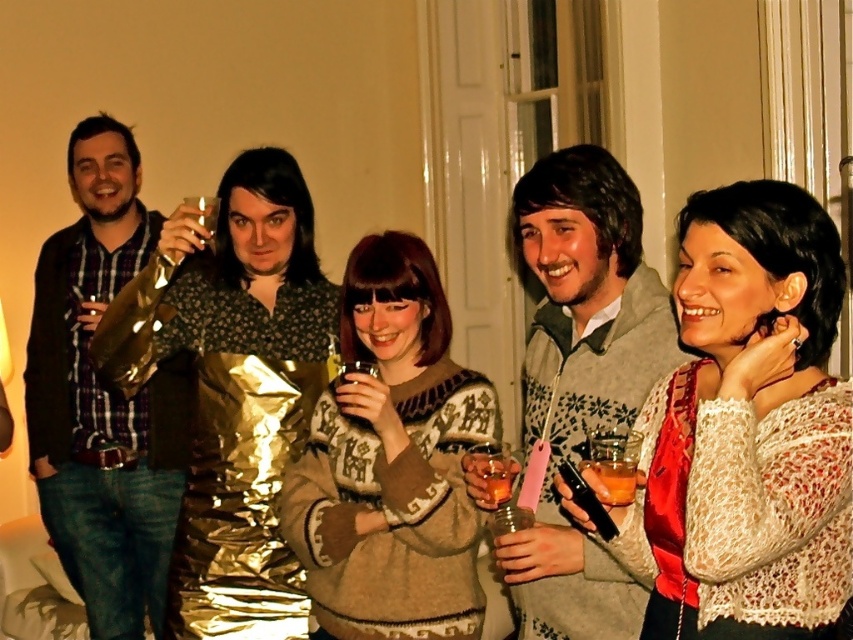
Question: Which object appears closest to the camera in this image?

Choices:
 (A) knitted beige sweater at center
 (B) matte black shirt at left
 (C) translucent amber glass at lower right

Answer: (C)

Question: Among these points, which one is nearest to the camera?

Choices:
 (A) (56, 445)
 (B) (635, 467)

Answer: (B)

Question: Is white lace sweater at center smaller than translucent glass at center?

Choices:
 (A) yes
 (B) no

Answer: (B)

Question: Is translucent amber glass at lower right above translucent glass at center?

Choices:
 (A) yes
 (B) no

Answer: (A)

Question: Does knitted beige sweater at center come behind gray sweater at center?

Choices:
 (A) yes
 (B) no

Answer: (A)

Question: Among these objects, which one is farthest from the camera?

Choices:
 (A) translucent amber glass at lower right
 (B) knitted beige sweater at center
 (C) white lace sweater at center

Answer: (B)